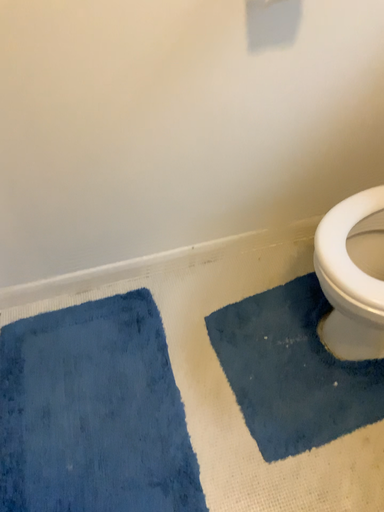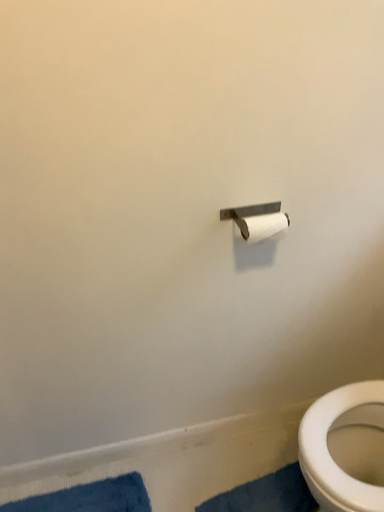
Question: How did the camera likely rotate when shooting the video?

Choices:
 (A) rotated upward
 (B) rotated downward

Answer: (A)